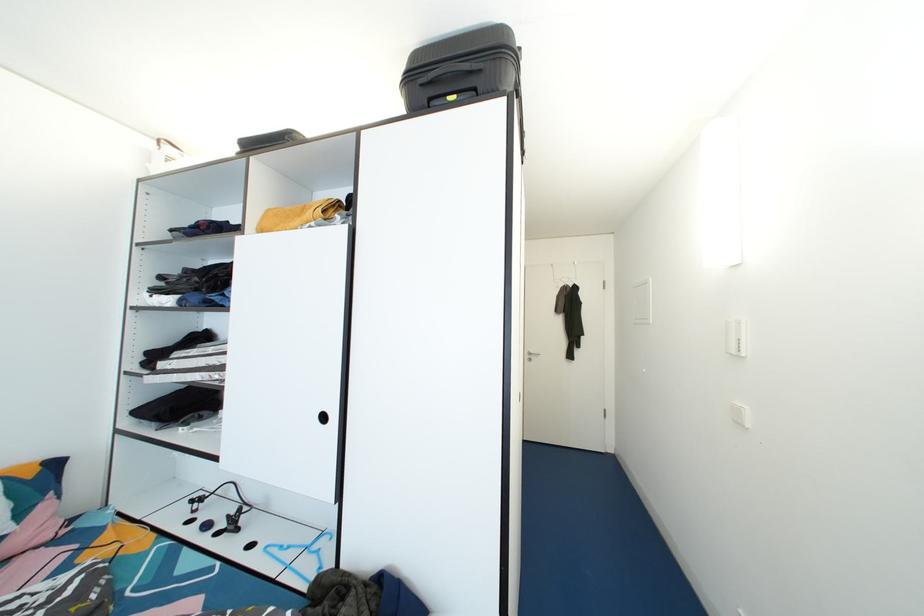
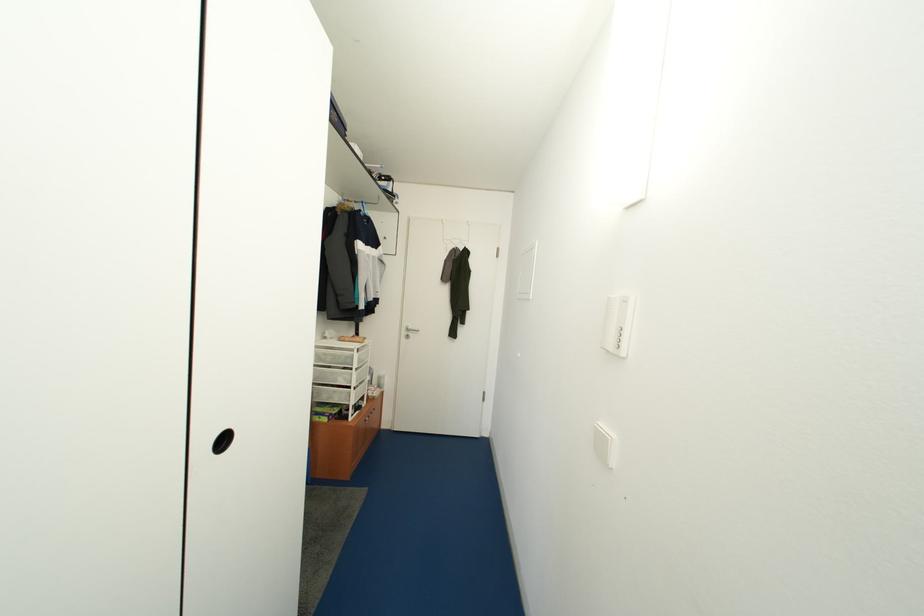
What movement of the cameraman would produce the second image?

The cameraman moved toward right, forward.